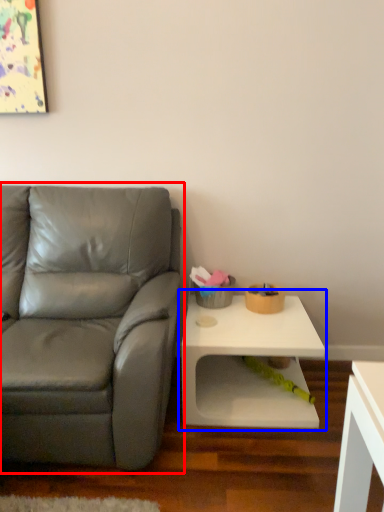
Question: Which object is further to the camera taking this photo, studio couch (highlighted by a red box) or table (highlighted by a blue box)?

Choices:
 (A) studio couch
 (B) table

Answer: (B)